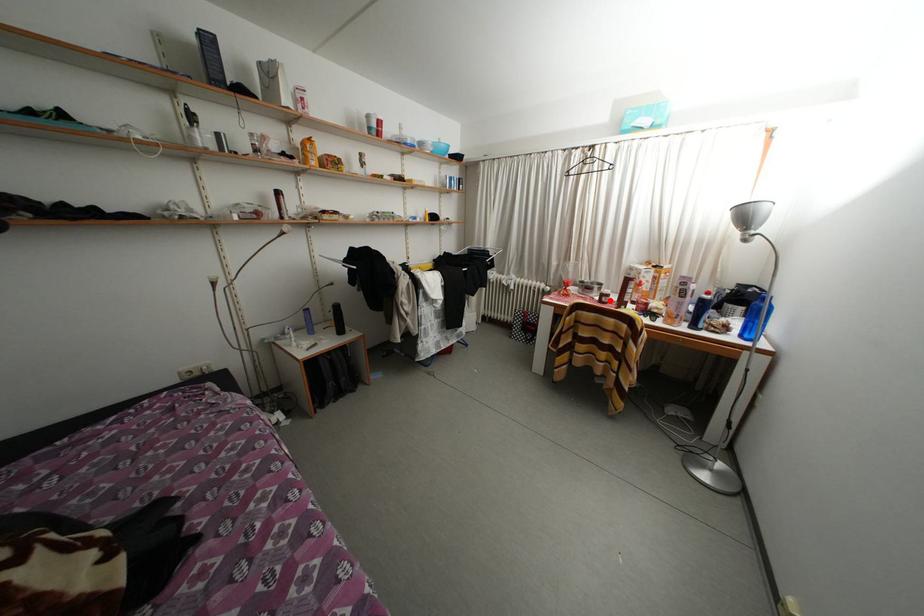
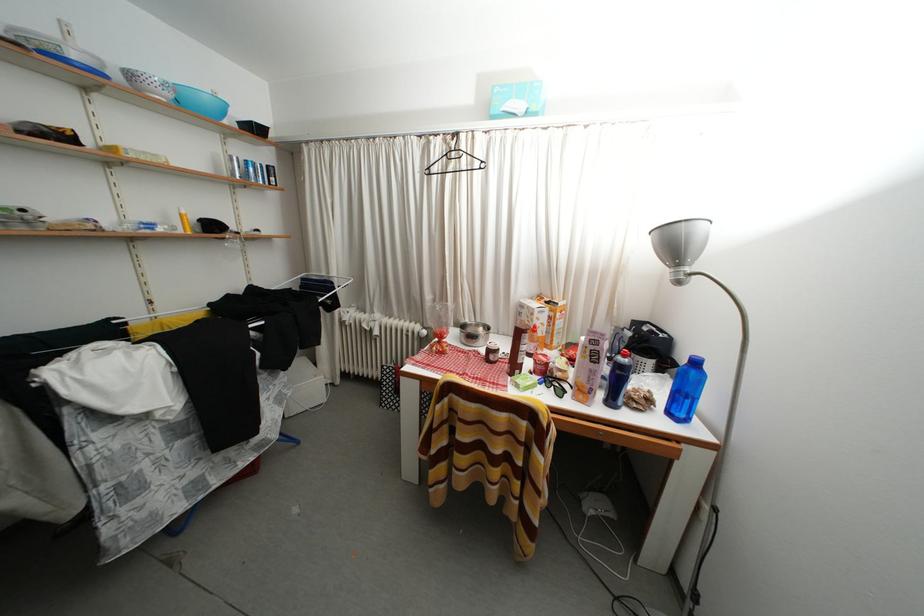
Where in the second image is the point corresponding to the highlighted location from the first image?

(496, 357)